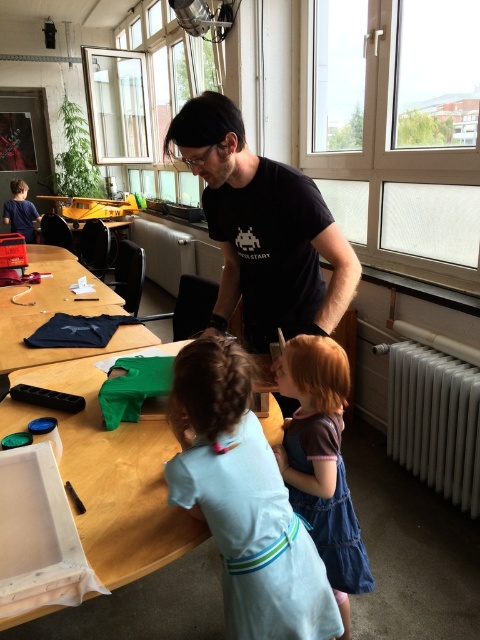
You are a parent trying to decide whether to place a small craft kit on the wooden table at center. Considering the size of the denim dress at center, will there be enough space for the craft kit?

The wooden table at center is larger in size than the denim dress at center, so there should be sufficient space to place the craft kit on the wooden table at center.

You are standing at the entrance of the room and want to find the wooden table at center. According to the coordinates given, in which direction should you walk to reach it?

The wooden table at center is located at coordinates point (x=118, y=481). Since the coordinates are in 2D space, the first number represents the horizontal axis and the second the vertical axis. A higher x value means it is to the right, and a higher y value means it is towards the bottom of the room. Therefore, you should walk towards the right and slightly downward from the entrance to reach the wooden table at center.

You are standing in the workshop and see two points marked on the floor. The first point is at coordinates point [207,518] and the second point is at point [243,304]. If you want to walk towards the first point, which direction should you move relative to the second point?

Point [207,518] is in front of point [243,304], so you should move forward from the second point to reach the first point.